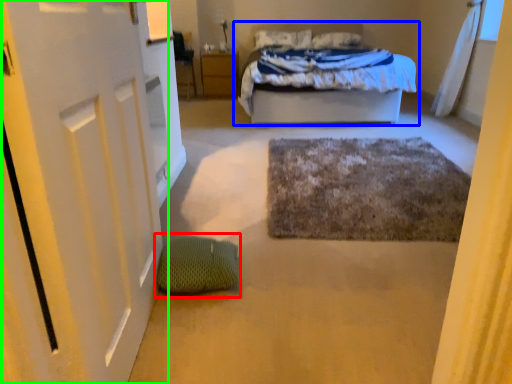
Question: Which object is positioned farthest from bean bag chair (highlighted by a red box)? Select from bed (highlighted by a blue box) and door (highlighted by a green box).

Choices:
 (A) bed
 (B) door

Answer: (A)